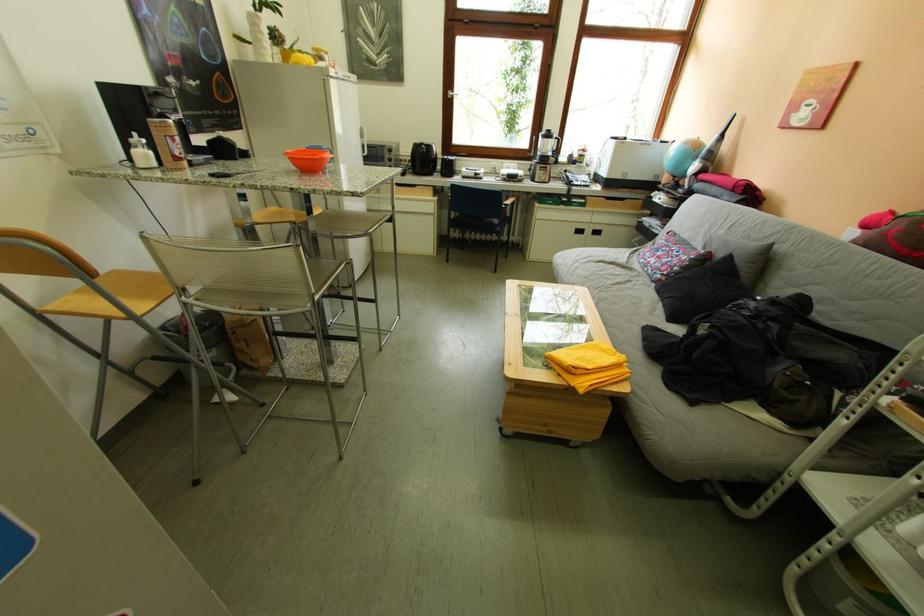
This screenshot has width=924, height=616. In order to click on vacuum cleaner handle in this screenshot , I will do `click(722, 164)`.